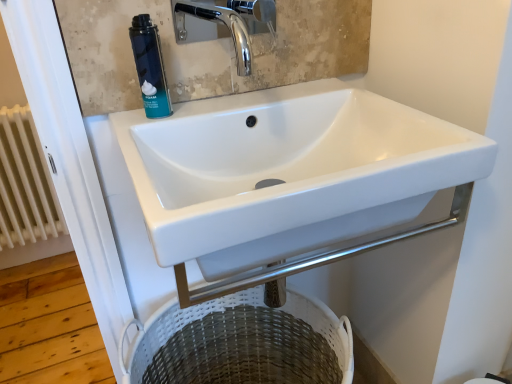
Question: Is white painted metal radiator at left bigger than chrome metallic faucet at upper center?

Choices:
 (A) yes
 (B) no

Answer: (A)

Question: Does white painted metal radiator at left have a greater width compared to chrome metallic faucet at upper center?

Choices:
 (A) no
 (B) yes

Answer: (A)

Question: Does white painted metal radiator at left come in front of chrome metallic faucet at upper center?

Choices:
 (A) yes
 (B) no

Answer: (B)

Question: Is white painted metal radiator at left positioned with its back to chrome metallic faucet at upper center?

Choices:
 (A) no
 (B) yes

Answer: (A)

Question: Are white painted metal radiator at left and chrome metallic faucet at upper center beside each other?

Choices:
 (A) yes
 (B) no

Answer: (B)

Question: From the image's perspective, is blue matte foam canister at upper left positioned above or below white woven laundry basket at lower center?

Choices:
 (A) below
 (B) above

Answer: (B)

Question: Based on their positions, is blue matte foam canister at upper left located to the left or right of white woven laundry basket at lower center?

Choices:
 (A) right
 (B) left

Answer: (B)

Question: Considering their positions, is blue matte foam canister at upper left located in front of or behind white woven laundry basket at lower center?

Choices:
 (A) behind
 (B) front

Answer: (A)

Question: Is blue matte foam canister at upper left inside the boundaries of white woven laundry basket at lower center, or outside?

Choices:
 (A) inside
 (B) outside

Answer: (B)

Question: Is white glossy sink at center in front of or behind white painted metal radiator at left in the image?

Choices:
 (A) front
 (B) behind

Answer: (A)

Question: From a real-world perspective, is white glossy sink at center positioned above or below white painted metal radiator at left?

Choices:
 (A) above
 (B) below

Answer: (A)

Question: Considering the positions of point (308, 97) and point (10, 231), is point (308, 97) closer or farther from the camera than point (10, 231)?

Choices:
 (A) farther
 (B) closer

Answer: (B)

Question: Based on their positions, is white glossy sink at center located to the left or right of white painted metal radiator at left?

Choices:
 (A) right
 (B) left

Answer: (A)

Question: Is white glossy sink at center wider or thinner than white woven laundry basket at lower center?

Choices:
 (A) wide
 (B) thin

Answer: (A)

Question: From the image's perspective, relative to white woven laundry basket at lower center, is white glossy sink at center above or below?

Choices:
 (A) above
 (B) below

Answer: (A)